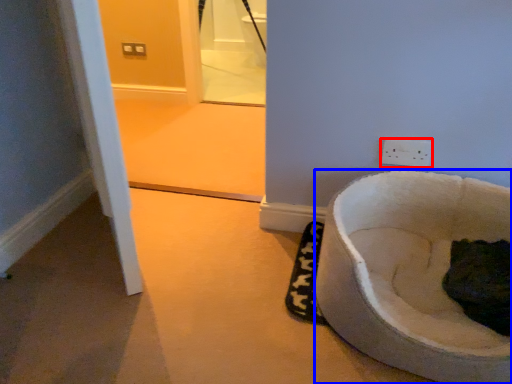
Question: Which point is closer to the camera, power plugs and sockets (highlighted by a red box) or toilet (highlighted by a blue box)?

Choices:
 (A) power plugs and sockets
 (B) toilet

Answer: (B)